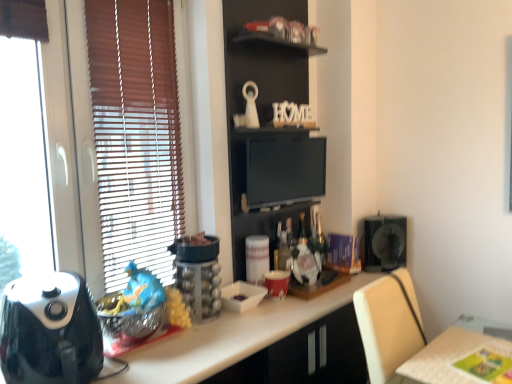
Identify the location of blank area beneath black plastic fan at right, marked as the 1th appliance in a back-to-front arrangement (from a real-world perspective). tap(379, 269).